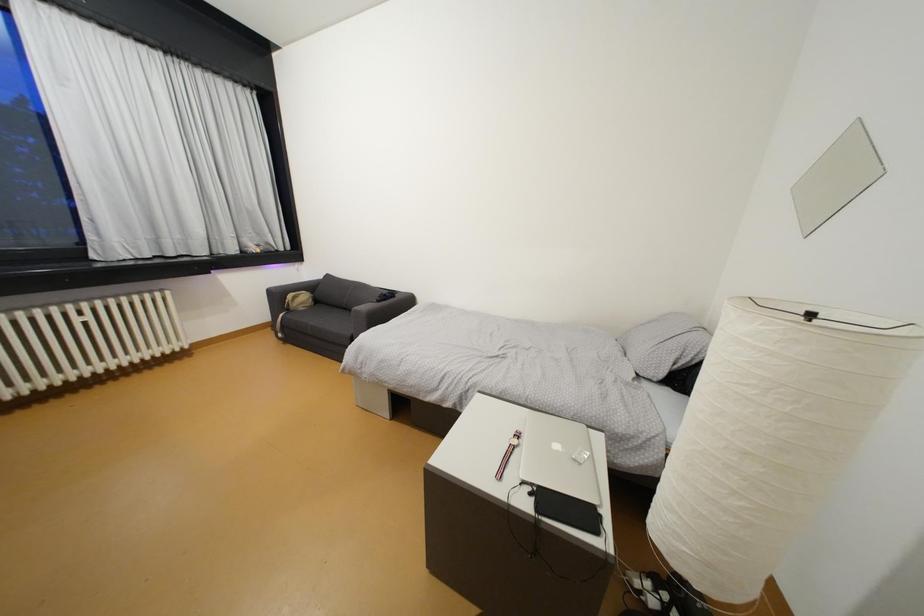
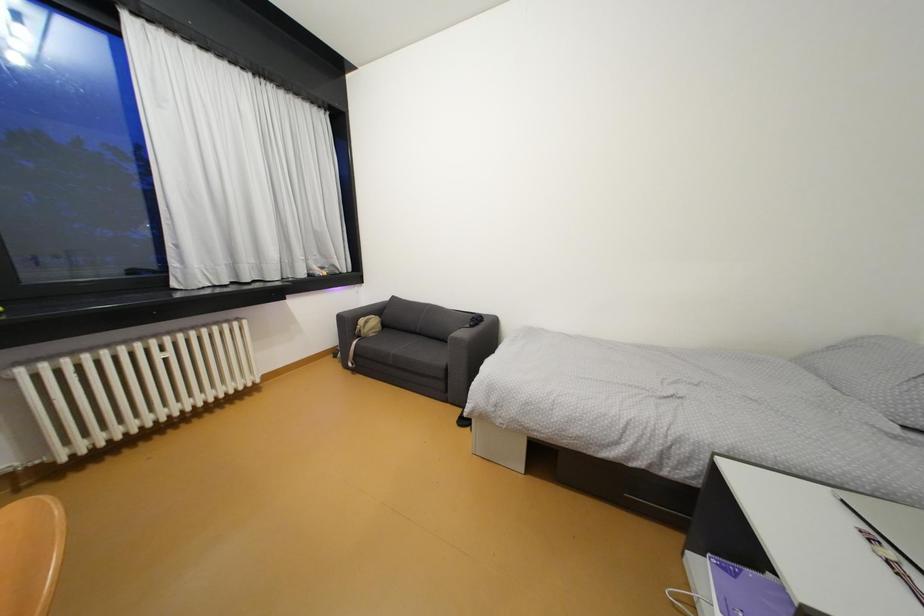
Question: Which direction would the cameraman need to move to produce the second image? Reply with the corresponding letter.

Choices:
 (A) Left
 (B) Right
 (C) Forward
 (D) Backward

Answer: (A)